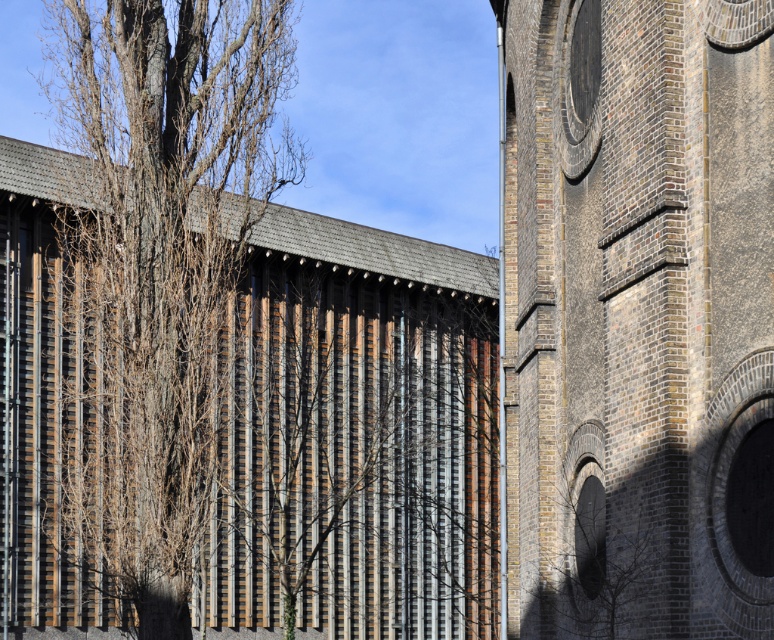
Question: Does wooden slats at center come in front of bare branches at left?

Choices:
 (A) no
 (B) yes

Answer: (A)

Question: Which of these objects is positioned farthest from the bare branches at left?

Choices:
 (A) brown wooden slats at center
 (B) wooden slats at center
 (C) brick tower at right

Answer: (C)

Question: Considering the real-world distances, which object is farthest from the wooden slats at center?

Choices:
 (A) brick tower at right
 (B) bare branches at left
 (C) brown wooden slats at center

Answer: (A)

Question: Does wooden slats at center have a lesser width compared to brown wooden slats at center?

Choices:
 (A) yes
 (B) no

Answer: (B)

Question: Can you confirm if wooden slats at center is smaller than brown wooden slats at center?

Choices:
 (A) no
 (B) yes

Answer: (A)

Question: Which object is positioned farthest from the brown wooden slats at center?

Choices:
 (A) wooden slats at center
 (B) brick tower at right

Answer: (B)